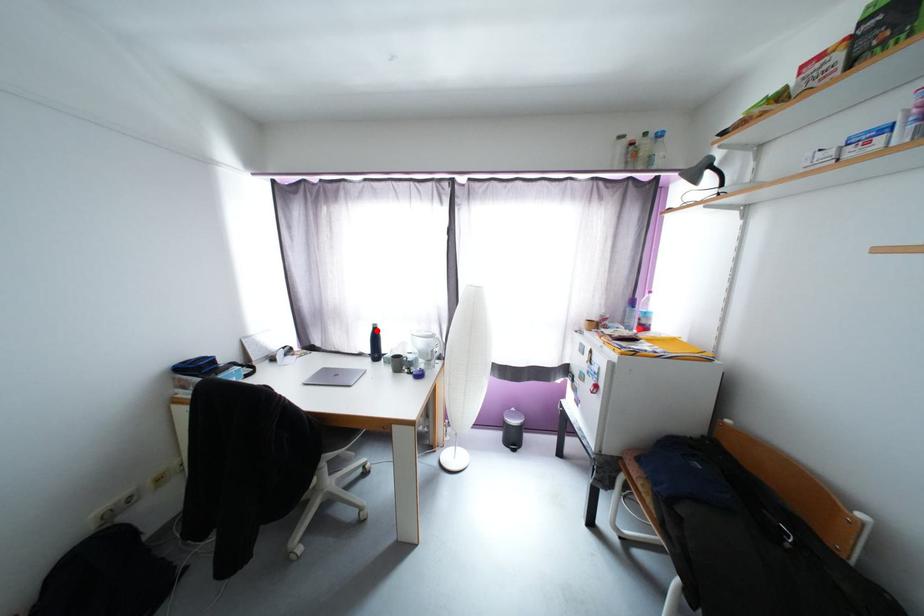
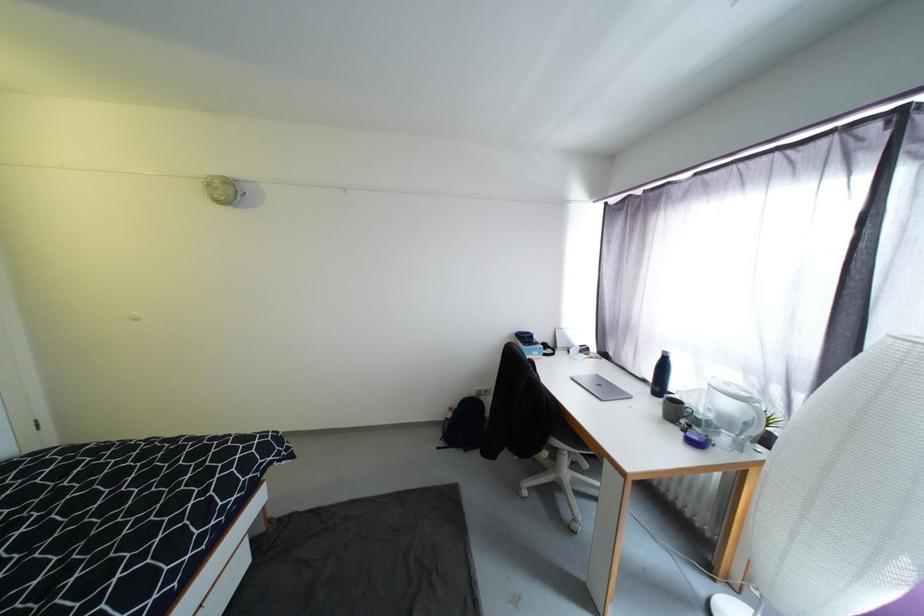
Question: I am providing you with two images of the same scene from different viewpoints. A red point is marked on the first image. At the location where the point appears in image 1, is it still visible in image 2?

Choices:
 (A) Yes
 (B) No

Answer: (B)